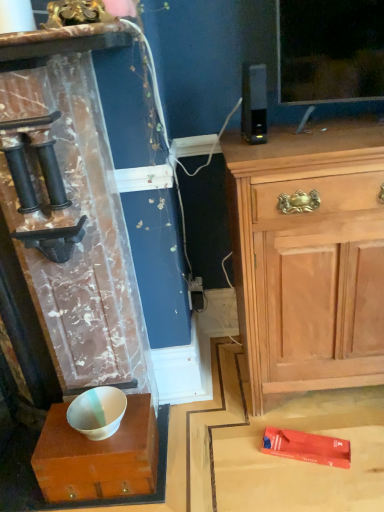
Where is `vacant area that is situated to the right of white glossy bowl at center`? This screenshot has height=512, width=384. vacant area that is situated to the right of white glossy bowl at center is located at coordinates (196, 452).